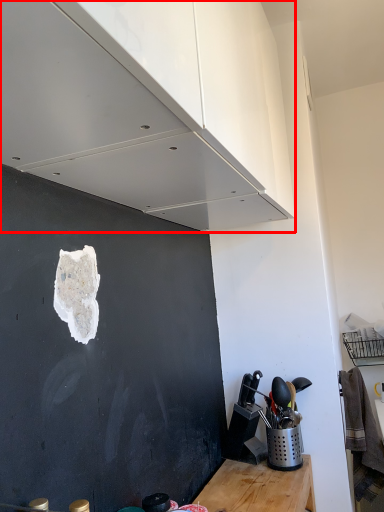
Question: From the image's perspective, considering the relative positions of cabinetry (annotated by the red box) and appliance in the image provided, where is cabinetry (annotated by the red box) located with respect to the staircase?

Choices:
 (A) above
 (B) below

Answer: (A)